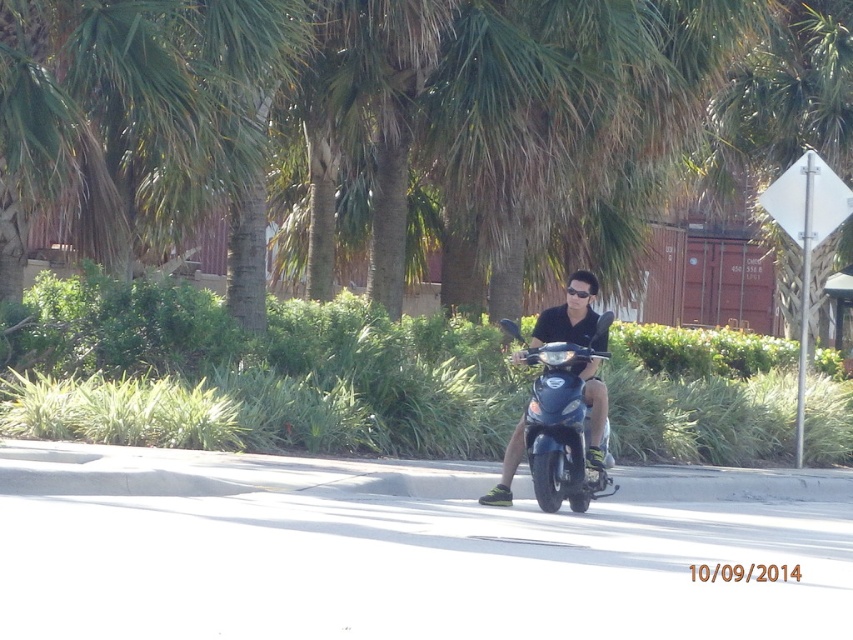
Consider the image. You are a photographer planning to capture a wide shot of the scene. Given that the green leafy tree at center and the glossy blue scooter at center are both in the frame, which object would appear larger in your photo?

The green leafy tree at center would appear larger in the photo because it is bigger than the glossy blue scooter at center according to the description.

You are a photographer trying to capture the glossy blue scooter at center and the green leafy tree at center in a single shot. Which object will appear larger in the photo?

The green leafy tree at center will appear larger in the photo because it is taller than the glossy blue scooter at center.

You are a delivery person who needs to deliver a package to the address located at the green leafy tree at center. Your scooter, the glossy blue scooter at center, has a range of 20 feet. Can you reach the destination without recharging?

The distance between the green leafy tree at center and the glossy blue scooter at center is 23.46 feet. Since the scooter has a range of only 20 feet, it cannot reach the destination without recharging.